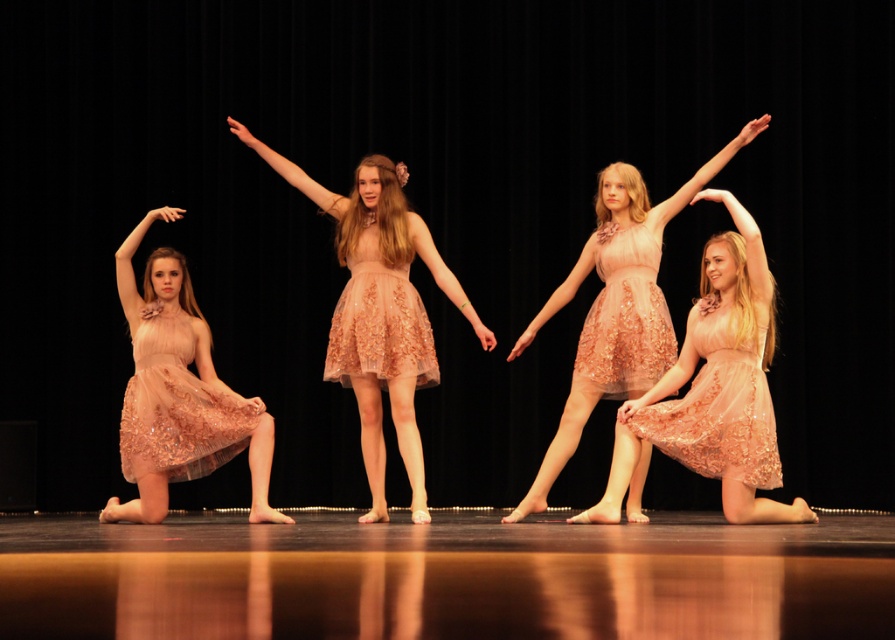
Question: Does matte tulle dress at center have a lesser width compared to lace peach dress at center?

Choices:
 (A) no
 (B) yes

Answer: (B)

Question: Does matte pink dress at center have a smaller size compared to sequined tulle dress at left?

Choices:
 (A) yes
 (B) no

Answer: (B)

Question: Is matte pink dress at center thinner than matte tulle dress at center?

Choices:
 (A) no
 (B) yes

Answer: (A)

Question: Which point is farther to the camera?

Choices:
 (A) (418, 371)
 (B) (241, 401)
 (C) (133, 317)

Answer: (B)

Question: Which point is farther from the camera taking this photo?

Choices:
 (A) (743, 392)
 (B) (373, 266)
 (C) (612, 163)

Answer: (C)

Question: Among these points, which one is nearest to the camera?

Choices:
 (A) (661, 339)
 (B) (237, 422)
 (C) (749, 332)

Answer: (C)